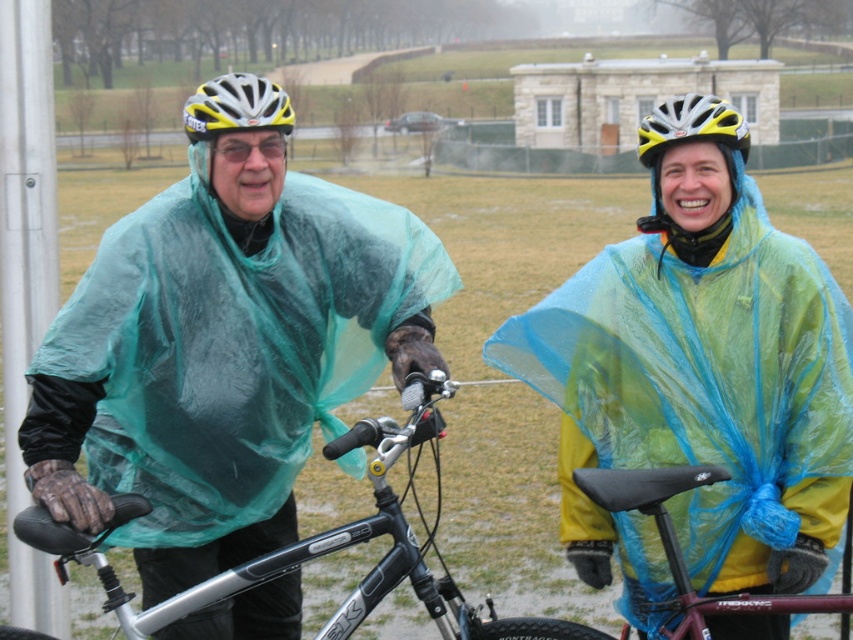
You are a drone operator trying to capture a photo of two cyclists. The cyclists are wearing the translucent blue poncho at center and another poncho. How far apart should you position the drone to ensure both cyclists are in frame?

The cyclists are 6.34 meters apart, so the drone should be positioned at least 6.34 meters away from the closer cyclist to ensure both are in frame.

You are a photographer trying to capture a clear shot of both the yellow matte helmet at upper left and the yellow and white matte bicycle helmet at upper center. Since you want to ensure both are visible in the frame, which helmet is positioned more to the right to help you frame them properly?

The yellow matte helmet at upper left is positioned to the right of the yellow and white matte bicycle helmet at upper center, so the yellow matte helmet at upper left is more to the right.